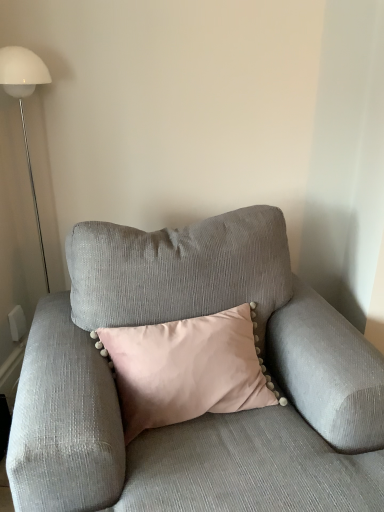
Describe the element at coordinates (207, 415) in the screenshot. I see `textured gray couch at center` at that location.

What is the approximate height of textured gray couch at center?

textured gray couch at center is 33.43 inches tall.

I want to click on textured gray couch at center, so click(207, 415).

In order to face textured gray couch at center, should I rotate leftwards or rightwards?

Rotate your view right by about 2.651°.

The width and height of the screenshot is (384, 512). I want to click on textured gray couch at center, so click(207, 415).